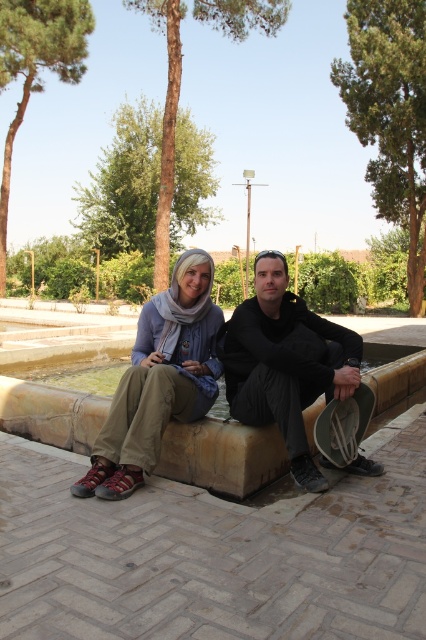
You are standing in a park and want to reach a specific point marked at coordinates point (270, 259). If you can walk 4 meters in 1 minute, how long will it take you to reach that point?

The distance of point (270, 259) from viewer is 3.48 meters. Since you can walk 4 meters in 1 minute, it will take approximately 0.87 minutes, or about 52 seconds, to reach the point.

You are a photographer standing 10 feet away from the matte black clothing at center. You want to take a photo of the camera that is near the people. Can you see the camera in your current position?

The matte black clothing at center and camera are 9.68 feet apart from each other. Since you are standing 10 feet away from the matte black clothing at center, the camera is only 0.32 feet behind the matte black clothing at center, so you can see the camera in your current position.